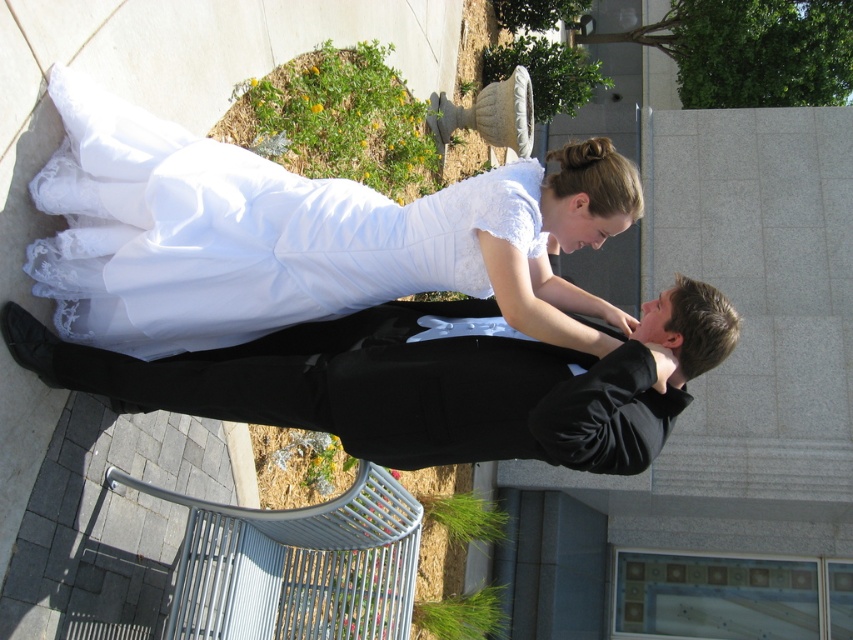
Question: Which of the following is the closest to the observer?

Choices:
 (A) black satin suit at center
 (B) white satin dress at center

Answer: (A)

Question: Which point appears closest to the camera in this image?

Choices:
 (A) (44, 372)
 (B) (184, 300)

Answer: (A)

Question: Does white satin dress at center appear under black satin suit at center?

Choices:
 (A) no
 (B) yes

Answer: (A)

Question: Can you confirm if white satin dress at center is positioned to the right of black satin suit at center?

Choices:
 (A) yes
 (B) no

Answer: (B)

Question: Considering the relative positions of white satin dress at center and black satin suit at center in the image provided, where is white satin dress at center located with respect to black satin suit at center?

Choices:
 (A) left
 (B) right

Answer: (A)